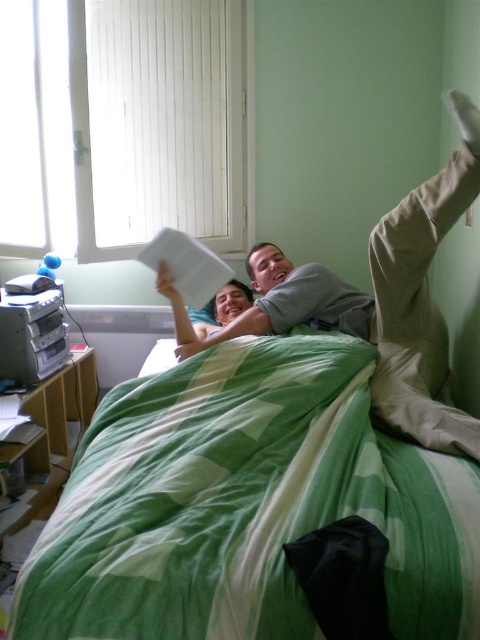
You are a photographer setting up a shoot in this room. You need to ensure that the green printed fabric blanket at center is visible in the shot. Since the gray cotton shirt at center might be covering it, can you confirm if the blanket is underneath or on top?

The green printed fabric blanket at center is positioned under gray cotton shirt at center, so the shirt is covering the blanket. To ensure the blanket is visible, you need to adjust the shirt or move it aside.

You are a photographer setting up a shoot in this room. You need to ensure that the green printed fabric blanket at center and the gray cotton shirt at center are both visible in the frame. Given their sizes, which object should you prioritize positioning closer to the camera to ensure it doesn

The green printed fabric blanket at center is shorter than the gray cotton shirt at center. To ensure both are visible, prioritize positioning the gray cotton shirt at center closer to the camera since it is taller and might be partially obscured if placed further back.

You are an interior designer analyzing the layout of a bedroom. You need to place a new decorative item on the bed without overlapping the green printed fabric blanket at center. Given that the blanket is positioned at coordinates point 0.787, 0.512, where would you place the item?

The green printed fabric blanket at center is located at point (245, 502). To place the new decorative item without overlapping it, you should position it either to the left or right of the blanket, ensuring the coordinates are different from (245, 502).